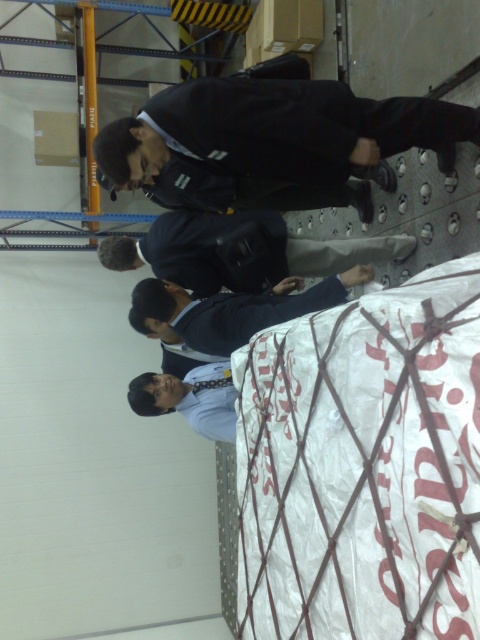
Question: Is black matte suit at center closer to the viewer compared to white matte robe at center?

Choices:
 (A) yes
 (B) no

Answer: (A)

Question: Which point is closer to the camera?

Choices:
 (A) dark blue suit at center
 (B) white matte robe at center

Answer: (B)

Question: Estimate the real-world distances between objects in this image. Which object is farther from the black matte suit at center?

Choices:
 (A) dark blue suit at center
 (B) white matte robe at center

Answer: (B)

Question: Is black matte suit at center smaller than white matte robe at center?

Choices:
 (A) yes
 (B) no

Answer: (B)

Question: Among these points, which one is nearest to the camera?

Choices:
 (A) [x=327, y=291]
 (B) [x=202, y=260]

Answer: (A)

Question: Is black matte suit at center wider than dark blue suit at center?

Choices:
 (A) yes
 (B) no

Answer: (B)